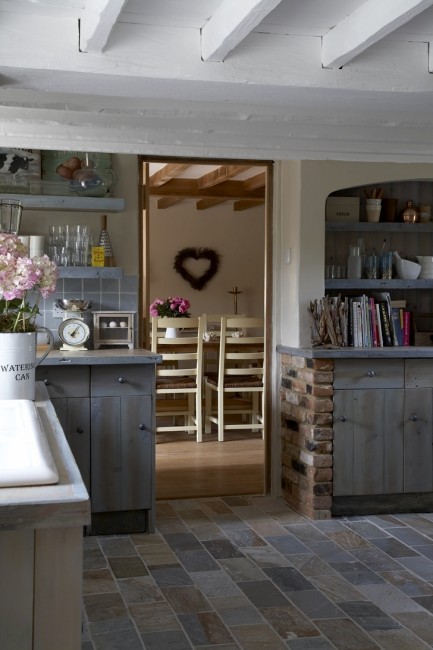
Where is `blue cabinet`? blue cabinet is located at coordinates (356, 439).